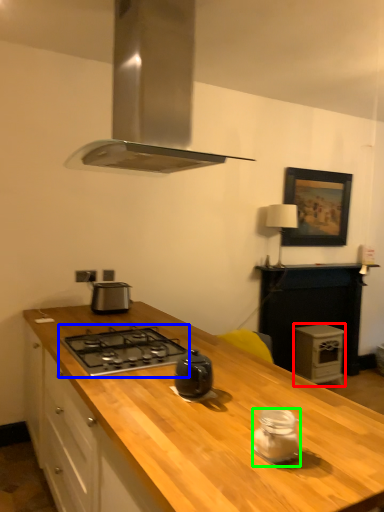
Question: Which object is the farthest from appliance (highlighted by a red box)? Choose among these: gas stove (highlighted by a blue box) or kitchen appliance (highlighted by a green box).

Choices:
 (A) gas stove
 (B) kitchen appliance

Answer: (B)